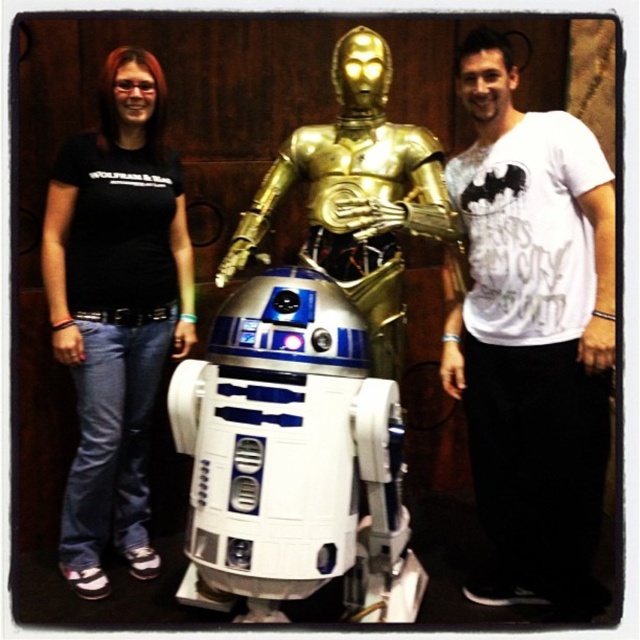
Question: Which object is the farthest from the black cotton shirt at left?

Choices:
 (A) gold metallic armor at center
 (B) white cotton t-shirt at right

Answer: (B)

Question: Which object is closer to the camera taking this photo?

Choices:
 (A) gold metallic armor at center
 (B) black cotton shirt at left
 (C) white cotton t-shirt at right

Answer: (C)

Question: Does white cotton t-shirt at right appear under black cotton shirt at left?

Choices:
 (A) yes
 (B) no

Answer: (A)

Question: In this image, where is white cotton t-shirt at right located relative to black cotton shirt at left?

Choices:
 (A) right
 (B) left

Answer: (A)

Question: Which of the following is the farthest from the observer?

Choices:
 (A) (337, 138)
 (B) (99, 552)
 (C) (529, 544)

Answer: (B)

Question: Can you confirm if white cotton t-shirt at right is positioned to the right of black cotton shirt at left?

Choices:
 (A) no
 (B) yes

Answer: (B)